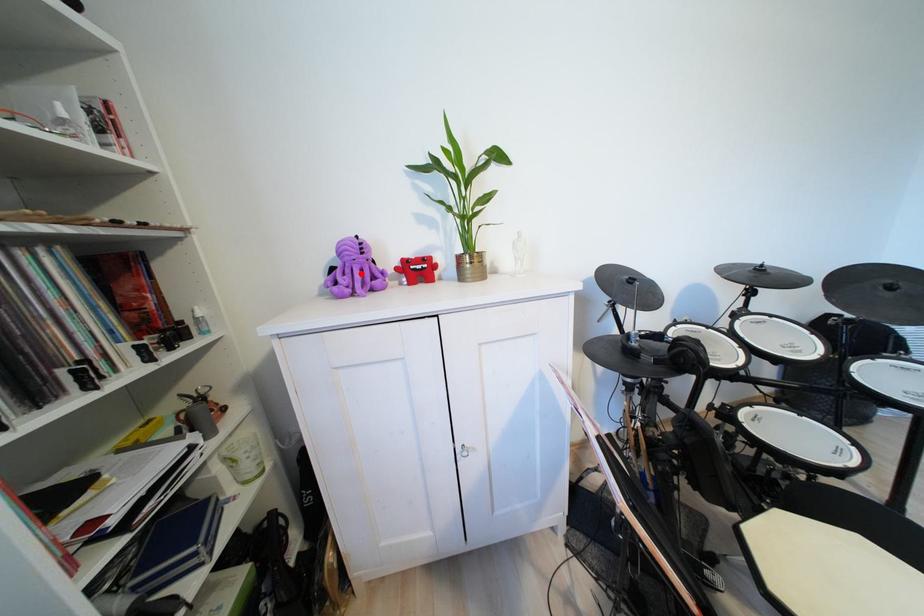
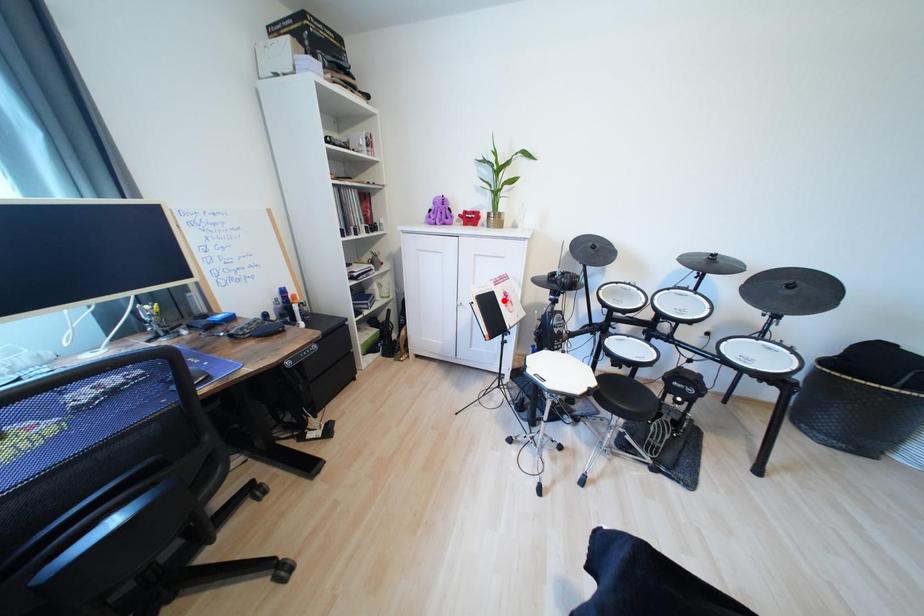
I am providing you with two images of the same scene from different viewpoints. A red point is marked on the first image and another point is marked on the second image. Do the highlighted points in image1 and image2 indicate the same real-world spot?

No